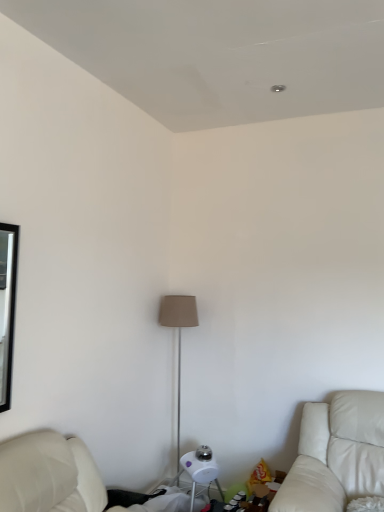
Question: Should I look upward or downward to see beige fabric lampshade at center?

Choices:
 (A) up
 (B) down

Answer: (B)